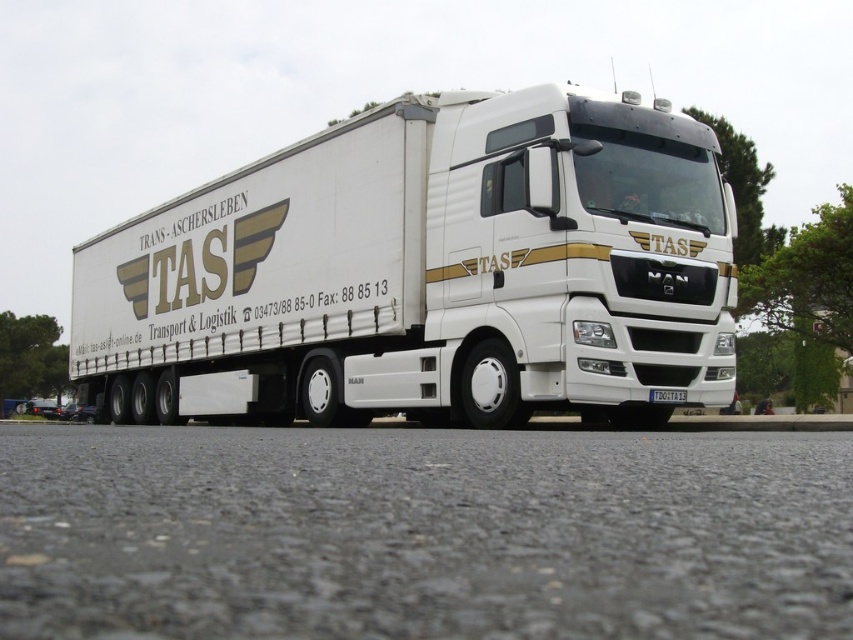
You are standing in front of the white semi truck with the TAS branding. There are two points marked on the truck. One at point (x=123, y=358) and another at point (x=660, y=396). Which point is closer to you?

Point (x=123, y=358) is closer to you because it is further to the viewer than point (x=660, y=396).

You are a delivery driver who needs to check the license plate of the white glossy truck at center. Can you see the white plastic license plate at center from your current position in front of the truck?

The white glossy truck at center is in front of the white plastic license plate at center, so you cannot see the white plastic license plate at center from your current position in front of the truck.

You are a delivery driver who needs to park your white glossy truck at center in a parking spot that is exactly the same width as your truck. You also have a white plastic license plate at center that needs to be visible. Can you determine if the license plate will still be visible if you park the truck perfectly centered in the spot?

The white glossy truck at center is wider than the white plastic license plate at center. Since the truck is wider, the license plate will still be visible as it is attached to the truck and centered. However, the parking spot must accommodate the truck width for proper visibility.